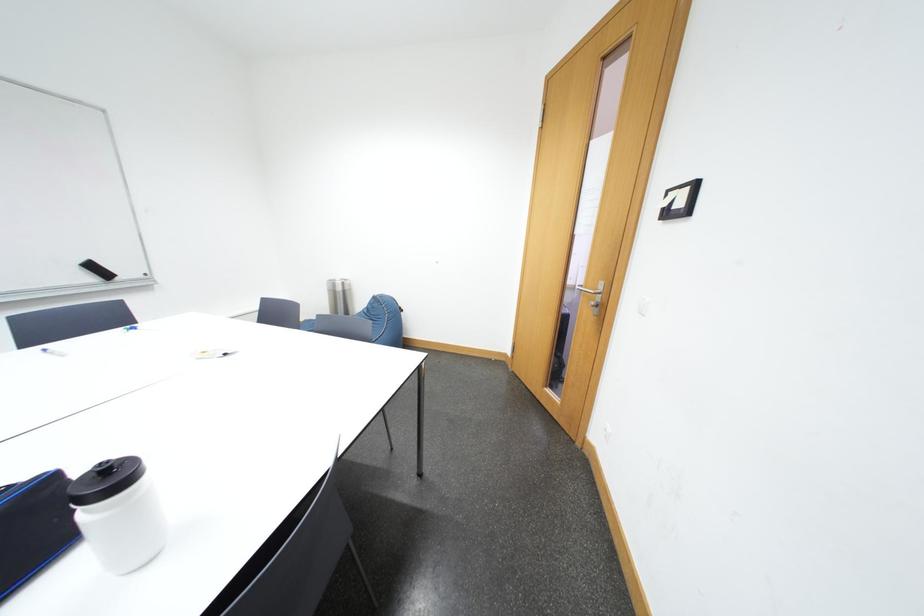
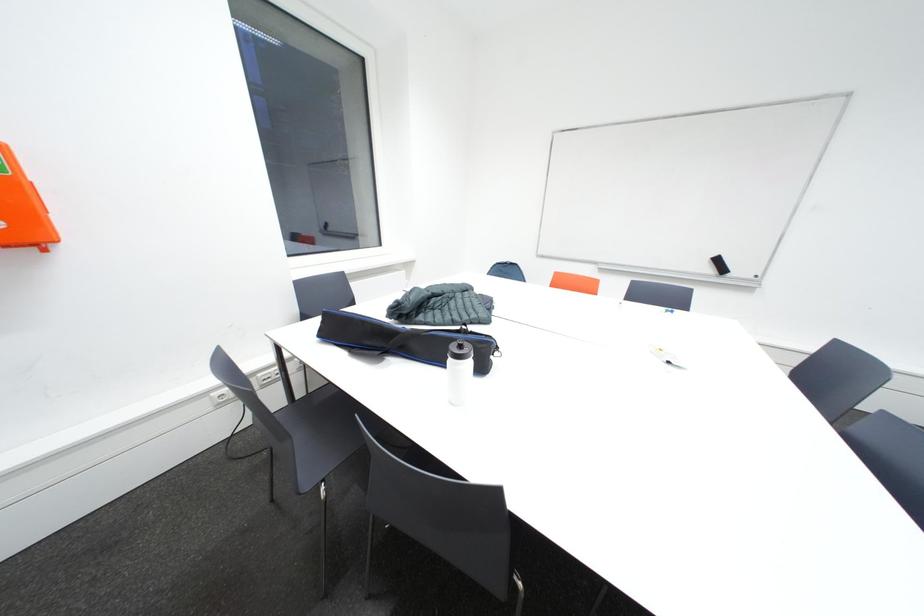
How did the camera likely rotate?

The rotation direction of the camera is left-down.